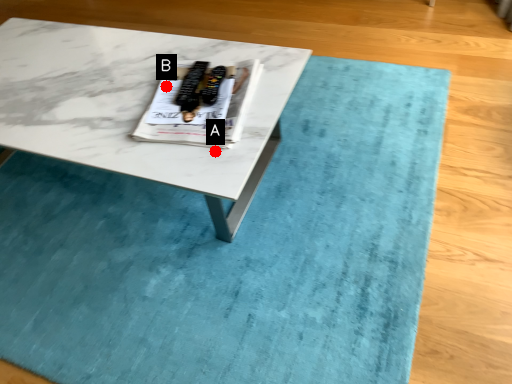
Question: Two points are circled on the image, labeled by A and B beside each circle. Among these points, which one is farthest from the camera?

Choices:
 (A) A is further
 (B) B is further

Answer: (B)